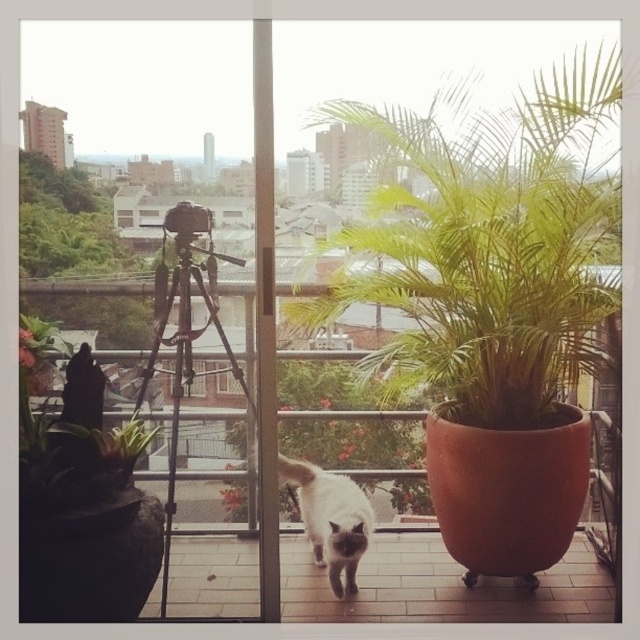
You are standing at the entrance of the balcony and want to pet the white fur cat at center. There is a green leafy plant at center in the way. Can you walk around the plant to reach the cat without disturbing the plant?

The green leafy plant at center is to the right of white fur cat at center, so you can walk around the left side of the plant to reach the cat without disturbing the plant.

You are a photographer trying to capture a clear shot of the white fur cat at center without any obstructions. Based on the scene, will the green matte plant at left block your view of the cat?

The green matte plant at left is in front of the white fur cat at center, so it will block your view of the cat.

You are standing at the center of the balcony looking through the glass door. Which object is closer to the top edge of the glass door? The green leafy plant at upper right or the white cat with dark markings on its face and ears?

The green leafy plant at upper right is closer to the top edge of the glass door because its 2D location at point [490,244] places it higher up in the frame compared to the white cat with dark markings on its face and ears.